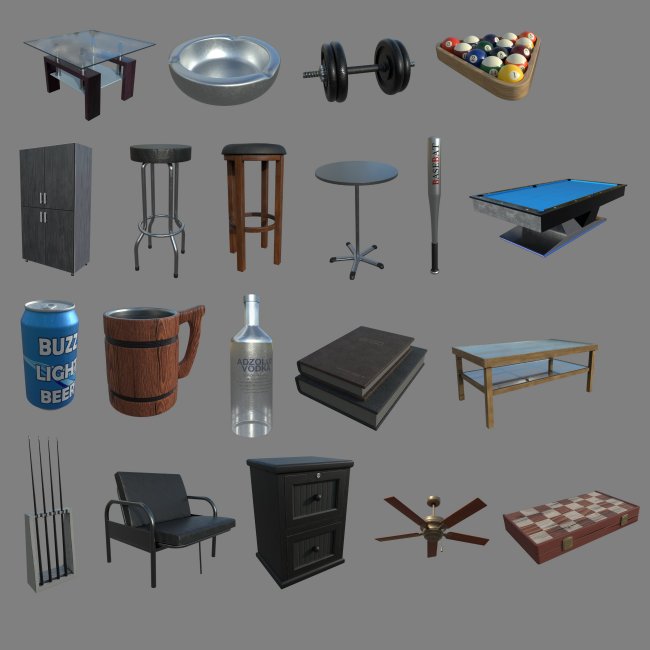
The image size is (650, 650). Find the location of `fan blades`. fan blades is located at coordinates (455, 517), (467, 537), (393, 537), (402, 509).